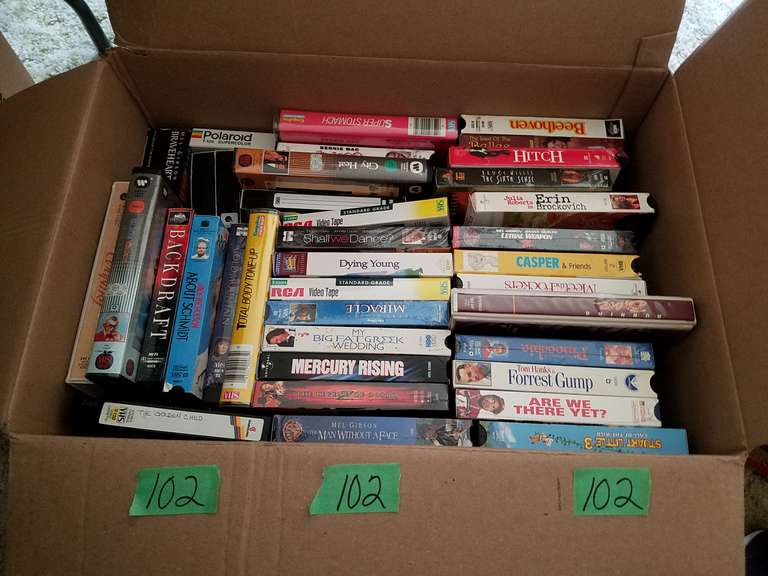
You are a GUI agent. You are given a task and a screenshot of the screen. Output one action in this format:
    pyautogui.click(x=<x>, y=<y>)
    Task: Click on the unlabeled vhs tape
    The image size is (768, 576).
    Given the screenshot: What is the action you would take?
    pyautogui.click(x=320, y=202), pyautogui.click(x=389, y=208), pyautogui.click(x=240, y=134)